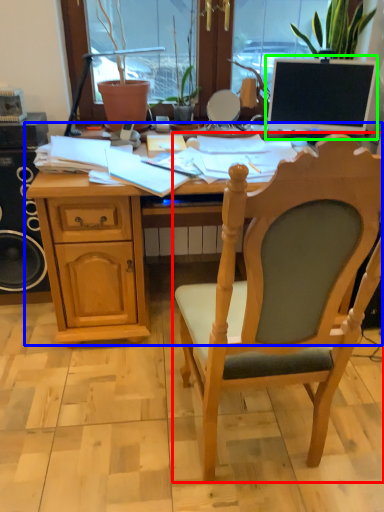
Question: Considering the real-world distances, which object is closest to chair (highlighted by a red box)? desk (highlighted by a blue box) or computer monitor (highlighted by a green box).

Choices:
 (A) desk
 (B) computer monitor

Answer: (A)